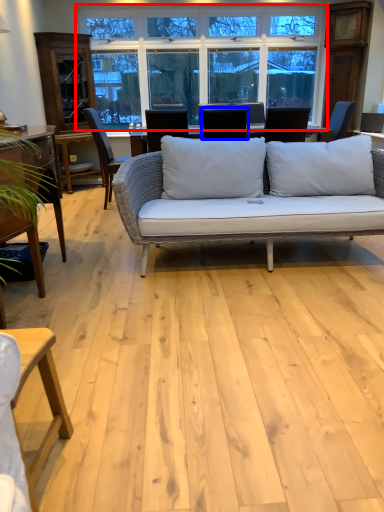
Question: Which of the following is the closest to the observer, window (highlighted by a red box) or chair (highlighted by a blue box)?

Choices:
 (A) window
 (B) chair

Answer: (B)